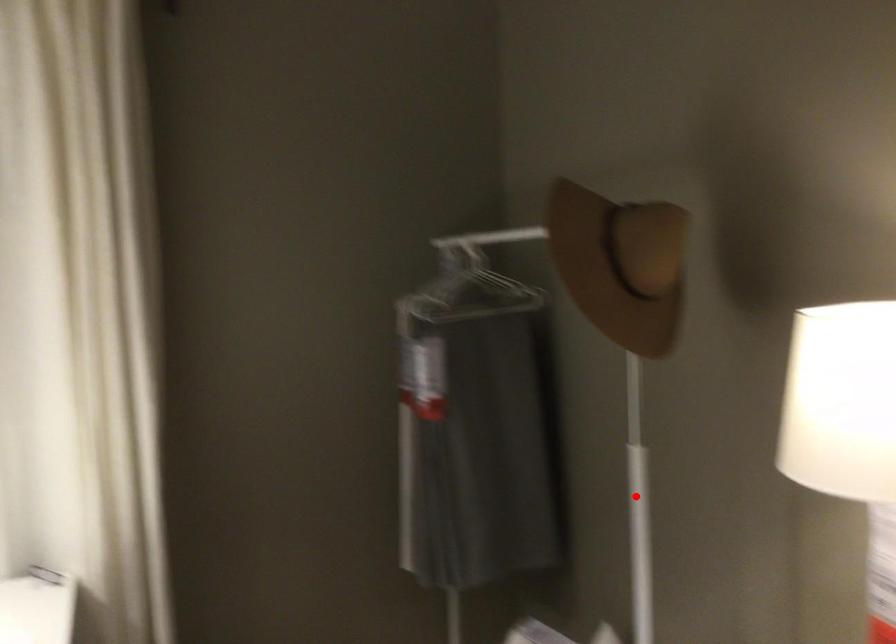
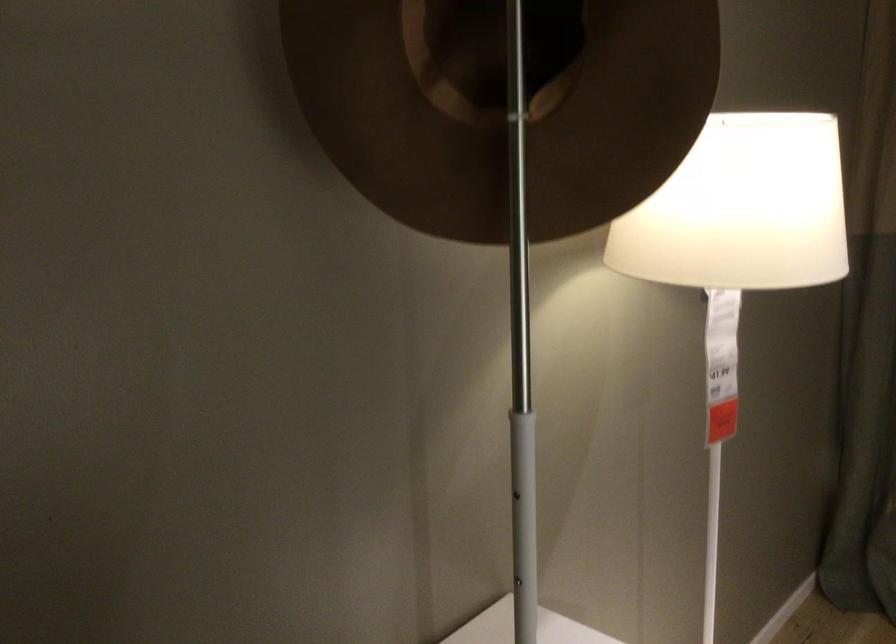
Question: A red point is marked in image1. In image2, is the corresponding 3D point closer to the camera or farther? Reply with the corresponding letter.

Choices:
 (A) The corresponding 3D point is closer.
 (B) The corresponding 3D point is farther.

Answer: (A)